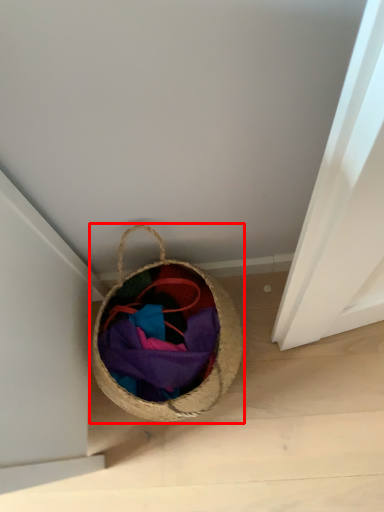
Question: Observing the image, what is the correct spatial positioning of picnic basket (annotated by the red box) in reference to clothing?

Choices:
 (A) right
 (B) left

Answer: (B)